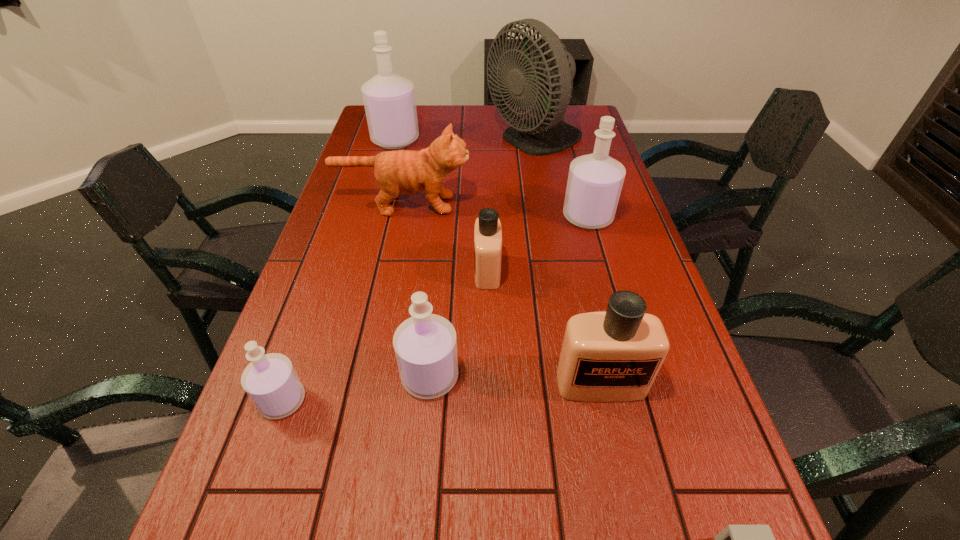
The height and width of the screenshot is (540, 960). In order to click on the fifth nearest object in this screenshot , I will do `click(487, 231)`.

I want to click on the fourth nearest perfume, so click(487, 231).

Identify the location of the smallest purple perfume. (270, 380).

Identify the location of vacant space located in front of the fan to direct airflow. (403, 141).

Identify the location of free space located in front of the fan to direct airflow. The image size is (960, 540). (395, 141).

Where is `free space located in front of the fan to direct airflow`? The height and width of the screenshot is (540, 960). free space located in front of the fan to direct airflow is located at coordinates (431, 141).

This screenshot has width=960, height=540. I want to click on free region located 0.140m on the front of the farthest purple perfume, so click(x=386, y=173).

Where is `free location located 0.340m on the back of the second biggest purple perfume`? The width and height of the screenshot is (960, 540). free location located 0.340m on the back of the second biggest purple perfume is located at coordinates (567, 146).

Identify the location of free point located 0.280m on the face of the ginger cat. Image resolution: width=960 pixels, height=540 pixels. (564, 205).

I want to click on vacant space located 0.360m on the back of the second smallest purple perfume, so click(x=443, y=242).